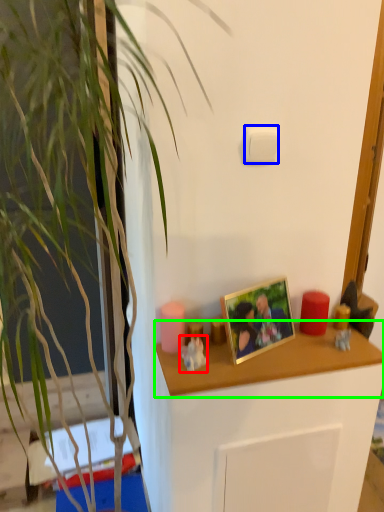
Question: Estimate the real-world distances between objects in this image. Which object is closer to toy (highlighted by a red box), light switch (highlighted by a blue box) or desk (highlighted by a green box)?

Choices:
 (A) light switch
 (B) desk

Answer: (B)